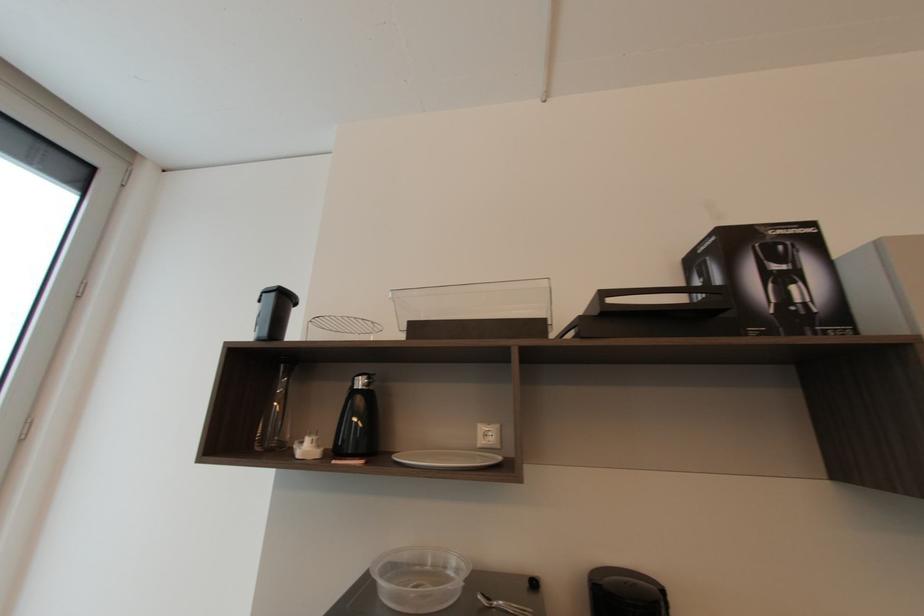
Where is `black canister lid`? The width and height of the screenshot is (924, 616). black canister lid is located at coordinates (657, 314).